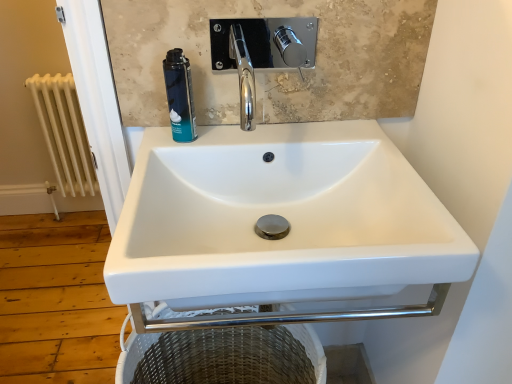
Question: Can you confirm if blue matte shaving cream can at upper left is bigger than white painted metal radiator at left?

Choices:
 (A) yes
 (B) no

Answer: (B)

Question: Does blue matte shaving cream can at upper left have a greater width compared to white painted metal radiator at left?

Choices:
 (A) yes
 (B) no

Answer: (B)

Question: From a real-world perspective, is blue matte shaving cream can at upper left physically below white painted metal radiator at left?

Choices:
 (A) no
 (B) yes

Answer: (A)

Question: Can you confirm if blue matte shaving cream can at upper left is smaller than white painted metal radiator at left?

Choices:
 (A) yes
 (B) no

Answer: (A)

Question: From the image's perspective, is blue matte shaving cream can at upper left on top of white painted metal radiator at left?

Choices:
 (A) yes
 (B) no

Answer: (B)

Question: Considering the relative positions of blue matte shaving cream can at upper left and white painted metal radiator at left in the image provided, is blue matte shaving cream can at upper left behind white painted metal radiator at left?

Choices:
 (A) yes
 (B) no

Answer: (B)

Question: Can you confirm if blue matte shaving cream can at upper left is taller than white ceramic sink at center?

Choices:
 (A) yes
 (B) no

Answer: (B)

Question: Is white ceramic sink at center a part of blue matte shaving cream can at upper left?

Choices:
 (A) no
 (B) yes

Answer: (A)

Question: Is blue matte shaving cream can at upper left facing towards white ceramic sink at center?

Choices:
 (A) yes
 (B) no

Answer: (B)

Question: From the image's perspective, is blue matte shaving cream can at upper left on top of white ceramic sink at center?

Choices:
 (A) no
 (B) yes

Answer: (B)

Question: From the image's perspective, does blue matte shaving cream can at upper left appear lower than white ceramic sink at center?

Choices:
 (A) no
 (B) yes

Answer: (A)

Question: Is blue matte shaving cream can at upper left smaller than white ceramic sink at center?

Choices:
 (A) no
 (B) yes

Answer: (B)

Question: Can you confirm if white painted metal radiator at left is bigger than blue matte shaving cream can at upper left?

Choices:
 (A) yes
 (B) no

Answer: (A)